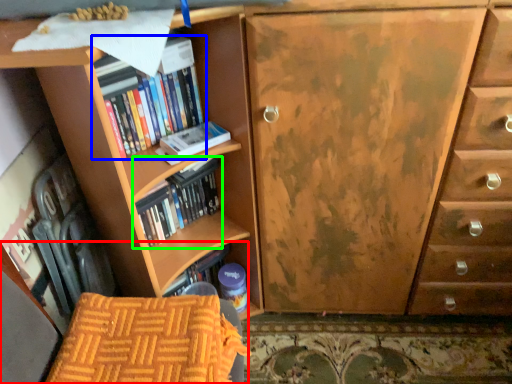
Question: Based on their relative distances, which object is farther from armchair (highlighted by a red box)? Choose from book (highlighted by a blue box) and book (highlighted by a green box).

Choices:
 (A) book
 (B) book

Answer: (A)